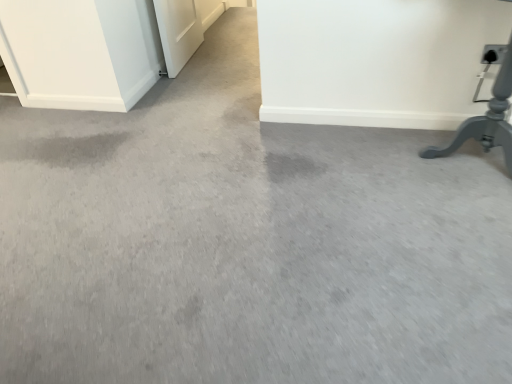
The width and height of the screenshot is (512, 384). Describe the element at coordinates (487, 120) in the screenshot. I see `matte gray tripod at right` at that location.

Find the location of `matte gray tripod at right`. matte gray tripod at right is located at coordinates point(487,120).

Where is `matte gray tripod at right`? This screenshot has width=512, height=384. matte gray tripod at right is located at coordinates (487, 120).